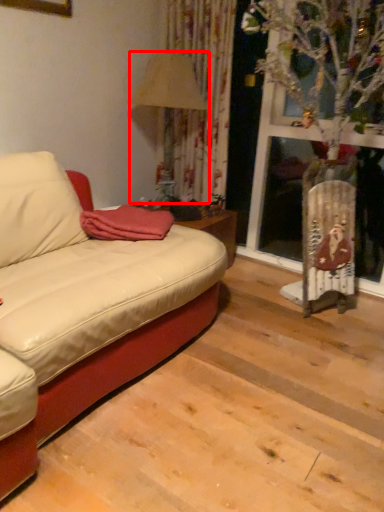
Question: From the image's perspective, where is lamp (annotated by the red box) located in relation to blanket in the image?

Choices:
 (A) below
 (B) above

Answer: (B)